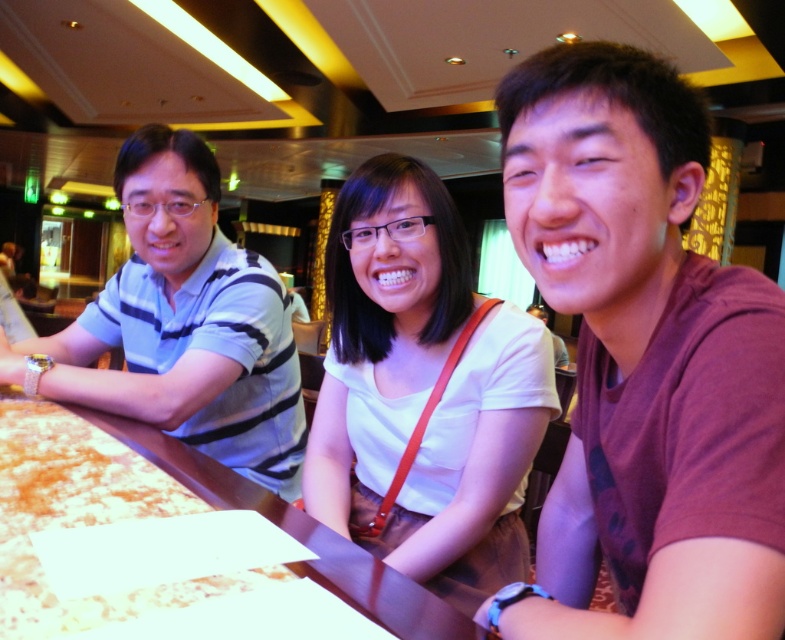
Is maroon cotton t-shirt at right positioned in front of striped cotton shirt at left?

Yes.

Who is more distant from viewer, (597, 419) or (155, 170)?

The point (155, 170) is more distant.

Locate an element on the screen. The height and width of the screenshot is (640, 785). maroon cotton t-shirt at right is located at coordinates (643, 360).

Between white matte shirt at center and brown wooden table at center, which one has more height?

With more height is white matte shirt at center.

Can you confirm if white matte shirt at center is positioned to the left of brown wooden table at center?

No, white matte shirt at center is not to the left of brown wooden table at center.

Identify the location of white matte shirt at center. This screenshot has width=785, height=640. 422,388.

The image size is (785, 640). What do you see at coordinates (643, 360) in the screenshot?
I see `maroon cotton t-shirt at right` at bounding box center [643, 360].

Does maroon cotton t-shirt at right have a smaller size compared to brown wooden table at center?

No.

Locate an element on the screen. The image size is (785, 640). maroon cotton t-shirt at right is located at coordinates (643, 360).

Image resolution: width=785 pixels, height=640 pixels. Identify the location of maroon cotton t-shirt at right. [643, 360].